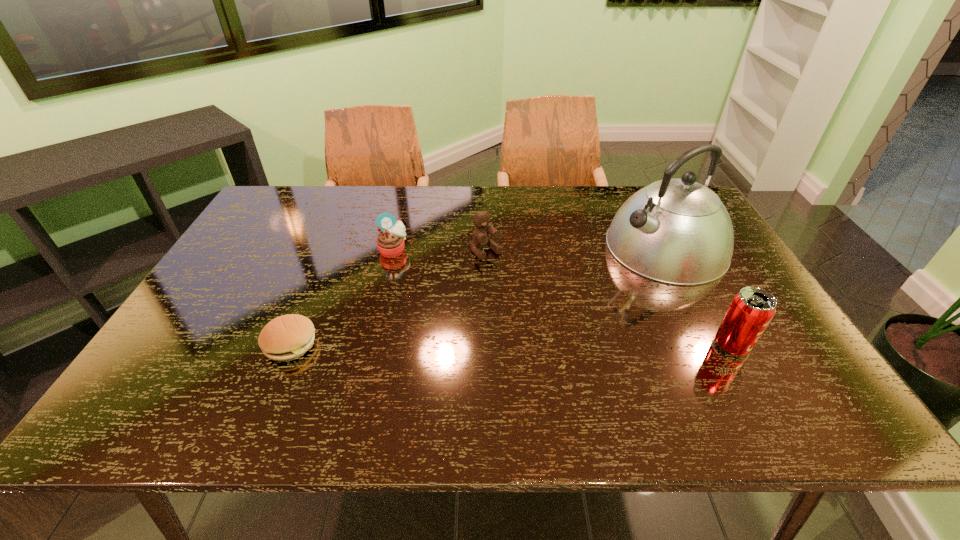
Find the location of a particular element. This screenshot has width=960, height=540. vacant area located 0.190m on the face of the teddy bear is located at coordinates (530, 301).

Locate an element on the screen. Image resolution: width=960 pixels, height=540 pixels. vacant space located on the front-facing side of the muffin is located at coordinates point(439,296).

Identify the location of free region located 0.280m on the front-facing side of the muffin. The width and height of the screenshot is (960, 540). (x=457, y=313).

Where is `free point located on the front-facing side of the muffin`? The width and height of the screenshot is (960, 540). free point located on the front-facing side of the muffin is located at coordinates (447, 304).

What are the coordinates of `vacant space located 0.350m from the spout of the kettle` in the screenshot? It's located at (528, 318).

Locate an element on the screen. free space located from the spout of the kettle is located at coordinates (562, 301).

At what (x,y) coordinates should I click in order to perform the action: click on free space located 0.140m from the spout of the kettle. Please return your answer as a coordinate pair (x, y). The width and height of the screenshot is (960, 540). Looking at the image, I should click on (589, 286).

This screenshot has height=540, width=960. I want to click on object that is at the far edge, so click(x=677, y=231).

The height and width of the screenshot is (540, 960). I want to click on patty at the near edge, so click(x=285, y=338).

You are a GUI agent. You are given a task and a screenshot of the screen. Output one action in this format:
    pyautogui.click(x=<x>, y=<y>)
    Task: Click on the soda can that is at the near edge
    
    Given the screenshot: What is the action you would take?
    pyautogui.click(x=751, y=310)